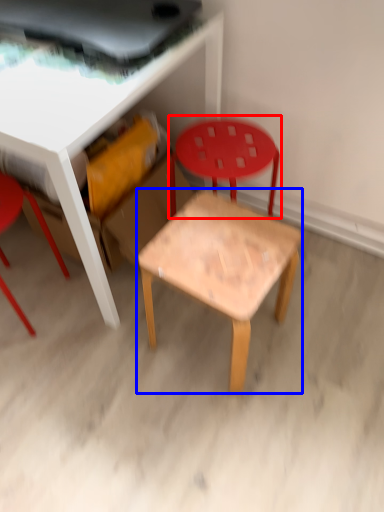
Question: Which object is further to the camera taking this photo, chair (highlighted by a red box) or side table (highlighted by a blue box)?

Choices:
 (A) chair
 (B) side table

Answer: (A)